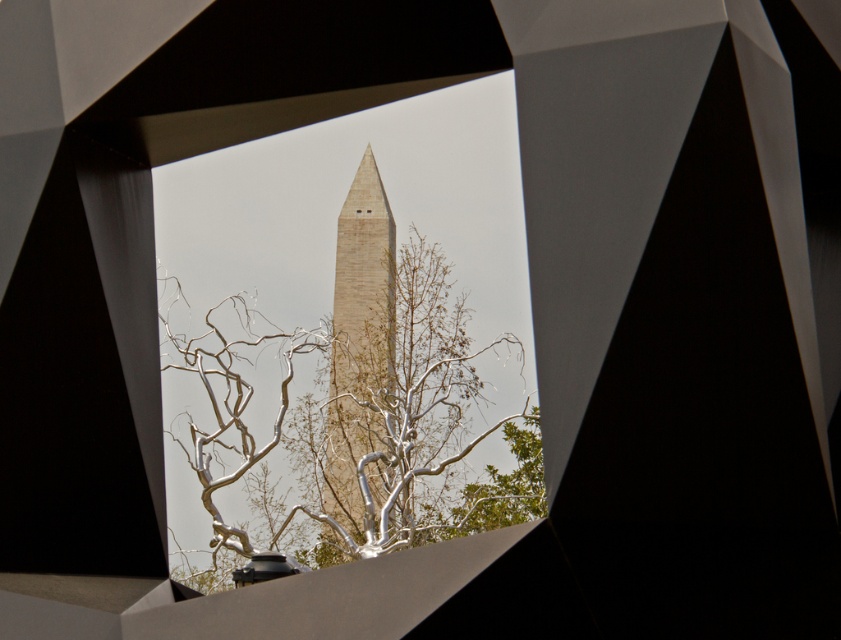
Is silver metallic branches at center thinner than beige stone obelisk at center?

No, silver metallic branches at center is not thinner than beige stone obelisk at center.

Can you confirm if silver metallic branches at center is taller than beige stone obelisk at center?

No, silver metallic branches at center is not taller than beige stone obelisk at center.

Is point (177, 298) behind point (355, 374)?

No, it is not.

What are the coordinates of `silver metallic branches at center` in the screenshot? It's located at (361, 432).